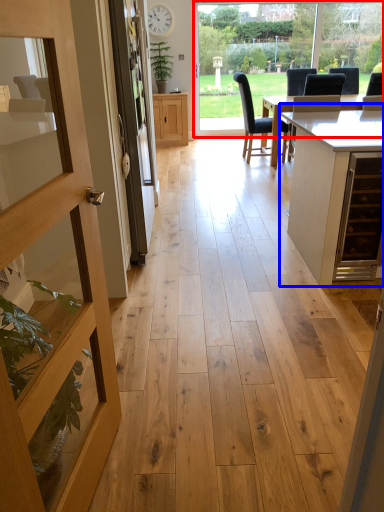
Question: Which of the following is the closest to the observer, window frame (highlighted by a red box) or table (highlighted by a blue box)?

Choices:
 (A) window frame
 (B) table

Answer: (B)